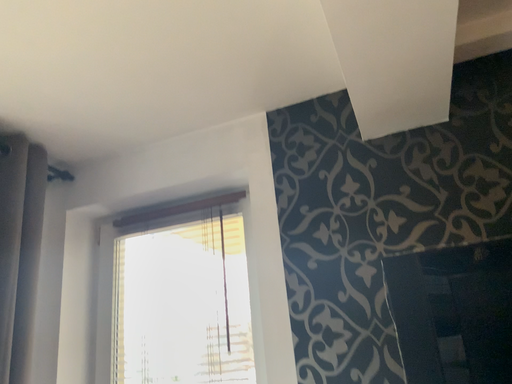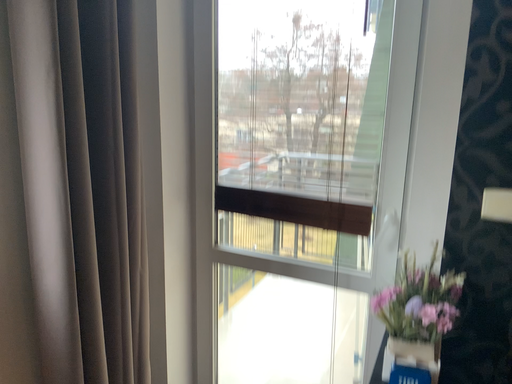
Question: Which way did the camera rotate in the video?

Choices:
 (A) rotated downward
 (B) rotated upward

Answer: (A)